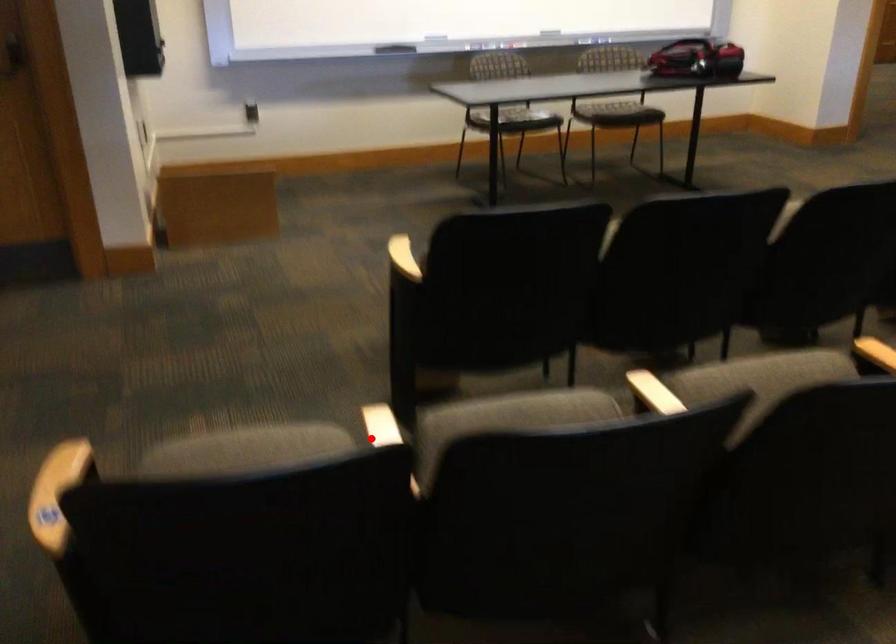
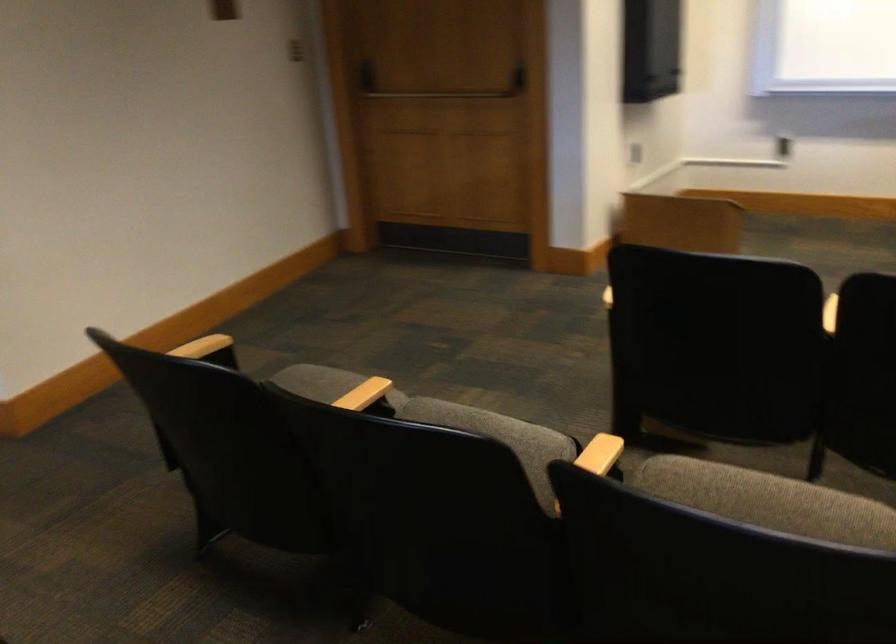
The point at the highlighted location is marked in the first image. Where is the corresponding point in the second image?

(350, 397)